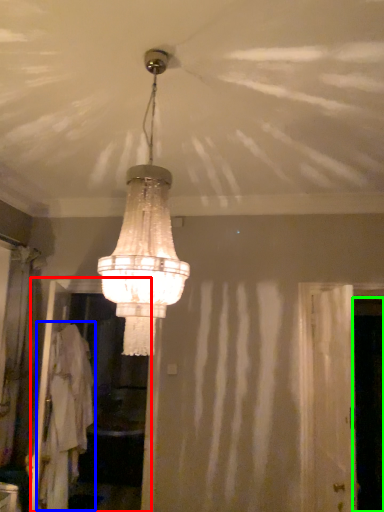
Question: Considering the real-world distances, which object is farthest from screen door (highlighted by a red box)? robe (highlighted by a blue box) or screen door (highlighted by a green box)?

Choices:
 (A) robe
 (B) screen door

Answer: (B)